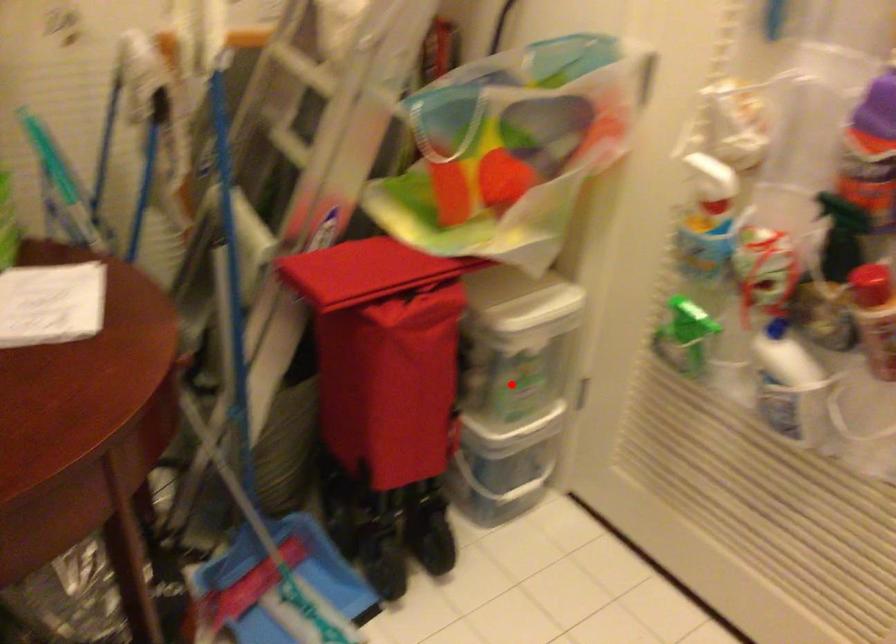
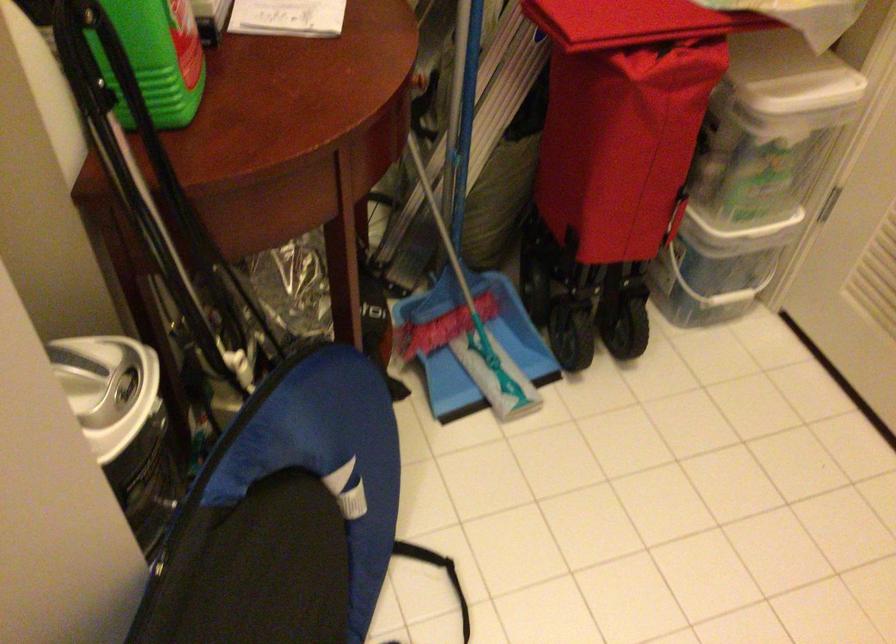
Question: I am providing you with two images of the same scene from different viewpoints. Given a red point in image1, look at the same physical point in image2. Is it:

Choices:
 (A) Closer to the viewpoint
 (B) Farther from the viewpoint

Answer: (A)